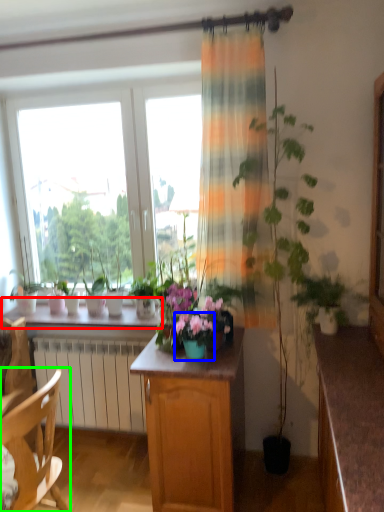
Question: Based on their relative distances, which object is nearer to window sill (highlighted by a red box)? Choose from flower box (highlighted by a blue box) and chair (highlighted by a green box).

Choices:
 (A) flower box
 (B) chair

Answer: (A)